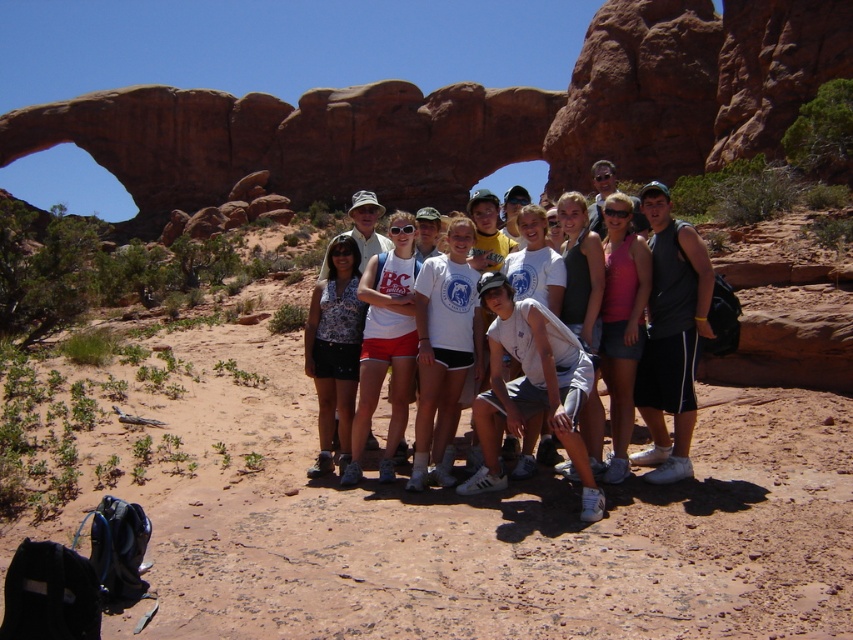
You are a photographer trying to capture the group of people in the desert. You notice two points marked on your camera screen at coordinates point (526, 387) and point (618, 353). Which point is closer to the camera?

Point (526, 387) is in front of point (618, 353), so it is closer to the camera.